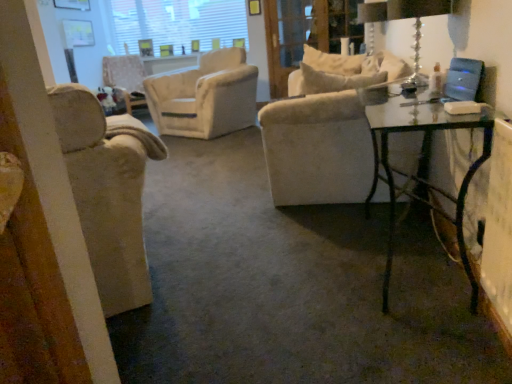
What do you see at coordinates (419, 174) in the screenshot? This screenshot has height=384, width=512. I see `transparent glass table at right` at bounding box center [419, 174].

Based on the photo, measure the distance between point (110, 29) and camera.

24.45 feet.

Identify the location of beige fabric chair at left, which appears as the first chair when ordered from the bottom. (108, 191).

Measure the distance between point (300,44) and camera.

They are 15.71 feet apart.

Locate an element on the screen. The image size is (512, 384). velvet beige armchair at center, positioned as the 2th chair in front-to-back order is located at coordinates (125, 79).

Find the location of a particular element. screen door in front of the velvet beige armchair at center, marked as the first chair in a top-to-bottom arrangement is located at coordinates (292, 37).

From the image's perspective, which one is positioned higher, velvet beige armchair at center, marked as the first chair in a top-to-bottom arrangement, or clear glass screen door at upper center?

From the image's view, clear glass screen door at upper center is above.

In the scene shown: Does velvet beige armchair at center, marked as the first chair in a top-to-bottom arrangement, have a greater height compared to clear glass screen door at upper center?

No, velvet beige armchair at center, marked as the first chair in a top-to-bottom arrangement, is not taller than clear glass screen door at upper center.

Is point (125, 201) more distant than point (283, 20)?

No, (125, 201) is closer to viewer.

Are beige fabric chair at left, which appears as the second chair when viewed from the top, and clear glass screen door at upper center far apart?

Yes, beige fabric chair at left, which appears as the second chair when viewed from the top, is far from clear glass screen door at upper center.

How different are the orientations of beige fabric chair at left, which is the 1th chair from right to left, and clear glass screen door at upper center in degrees?

beige fabric chair at left, which is the 1th chair from right to left, and clear glass screen door at upper center are facing 142 degrees away from each other.

Considering the relative positions of beige fabric chair at left, marked as the 2th chair in a left-to-right arrangement, and clear glass screen door at upper center in the image provided, is beige fabric chair at left, marked as the 2th chair in a left-to-right arrangement, to the left or to the right of clear glass screen door at upper center?

beige fabric chair at left, marked as the 2th chair in a left-to-right arrangement, is positioned on clear glass screen door at upper center's left side.

Is clear glass table lamp at upper right positioned in front of white textured window screen at upper center?

Yes, the depth of clear glass table lamp at upper right is less than that of white textured window screen at upper center.

Where is `table lamp that is below the white textured window screen at upper center (from the image's perspective)`? table lamp that is below the white textured window screen at upper center (from the image's perspective) is located at coordinates (417, 24).

Is clear glass table lamp at upper right oriented away from white textured window screen at upper center?

clear glass table lamp at upper right is not turned away from white textured window screen at upper center.

Measure the distance between clear glass table lamp at upper right and white textured window screen at upper center.

They are 6.21 meters apart.

Which is nearer, (226, 36) or (454, 118)?

Point (226, 36) is positioned farther from the camera compared to point (454, 118).

How different are the orientations of white textured window screen at upper center and transparent glass table at right in degrees?

The facing directions of white textured window screen at upper center and transparent glass table at right are 90.1 degrees apart.

Considering the relative sizes of white textured window screen at upper center and transparent glass table at right in the image provided, is white textured window screen at upper center shorter than transparent glass table at right?

Incorrect, the height of white textured window screen at upper center does not fall short of that of transparent glass table at right.

From a real-world perspective, between velvet beige armchair at center, positioned as the 2th chair in front-to-back order, and clear glass table lamp at upper right, who is vertically higher?

In real-world perspective, clear glass table lamp at upper right is above.

Does velvet beige armchair at center, which ranks as the 2th chair in bottom-to-top order, appear on the right side of clear glass table lamp at upper right?

In fact, velvet beige armchair at center, which ranks as the 2th chair in bottom-to-top order, is to the left of clear glass table lamp at upper right.

Is velvet beige armchair at center, positioned as the 2th chair in front-to-back order, located outside clear glass table lamp at upper right?

Yes, velvet beige armchair at center, positioned as the 2th chair in front-to-back order, is outside of clear glass table lamp at upper right.

Is point (143, 103) positioned after point (413, 47)?

Yes.

I want to click on chair in front of the velvet beige armchair at center, which ranks as the first chair in back-to-front order, so click(108, 191).

Is beige fabric chair at left, which is the 1th chair from right to left, next to velvet beige armchair at center, which ranks as the first chair in left-to-right order, and touching it?

beige fabric chair at left, which is the 1th chair from right to left, and velvet beige armchair at center, which ranks as the first chair in left-to-right order, are not in contact.

Which is nearer, (x=134, y=266) or (x=117, y=89)?

Point (x=134, y=266) is positioned closer to the camera compared to point (x=117, y=89).

From the image's perspective, which object appears higher, beige fabric chair at left, marked as the first chair in a front-to-back arrangement, or velvet beige armchair at center, which ranks as the first chair in back-to-front order?

velvet beige armchair at center, which ranks as the first chair in back-to-front order, is shown above in the image.

Considering the positions of objects beige fabric chair at left, marked as the first chair in a front-to-back arrangement, and white textured window screen at upper center in the image provided, who is more to the left, beige fabric chair at left, marked as the first chair in a front-to-back arrangement, or white textured window screen at upper center?

From the viewer's perspective, white textured window screen at upper center appears more on the left side.

Which is in front, beige fabric chair at left, which appears as the 2th chair when viewed from the back, or white textured window screen at upper center?

beige fabric chair at left, which appears as the 2th chair when viewed from the back, is closer to the camera.

Is beige fabric chair at left, which appears as the second chair when viewed from the top, turned away from white textured window screen at upper center?

That's not correct — beige fabric chair at left, which appears as the second chair when viewed from the top, is not looking away from white textured window screen at upper center.

Between beige fabric chair at left, marked as the 2th chair in a left-to-right arrangement, and white textured window screen at upper center, which one has more height?

With more height is white textured window screen at upper center.

You are a GUI agent. You are given a task and a screenshot of the screen. Output one action in this format:
    pyautogui.click(x=<x>, y=<y>)
    Task: Click on the screen door above the velvet beige armchair at center, which is the 2th chair in right-to-left order (from the image's perspective)
    This screenshot has height=384, width=512.
    Given the screenshot: What is the action you would take?
    pyautogui.click(x=292, y=37)

I want to click on screen door behind the beige fabric chair at left, which appears as the first chair when ordered from the bottom, so click(292, 37).

Estimate the real-world distances between objects in this image. Which object is closer to transparent glass table at right, clear glass screen door at upper center or beige fabric chair at left, which is the 1th chair from right to left?

beige fabric chair at left, which is the 1th chair from right to left, is positioned closer to the anchor transparent glass table at right.

Which object lies nearer to the anchor point white textured window screen at upper center, velvet beige armchair at center, which ranks as the first chair in left-to-right order, or clear glass screen door at upper center?

Based on the image, velvet beige armchair at center, which ranks as the first chair in left-to-right order, appears to be nearer to white textured window screen at upper center.

From the picture: When comparing their distances from transparent glass table at right, does clear glass table lamp at upper right or clear glass screen door at upper center seem further?

Among the two, clear glass screen door at upper center is located further to transparent glass table at right.

Based on their spatial positions, is clear glass table lamp at upper right or white textured window screen at upper center further from velvet beige armchair at center, which ranks as the first chair in back-to-front order?

clear glass table lamp at upper right is further to velvet beige armchair at center, which ranks as the first chair in back-to-front order.

Which object lies further to the anchor point white textured window screen at upper center, clear glass screen door at upper center or velvet beige armchair at center, which ranks as the first chair in back-to-front order?

clear glass screen door at upper center.

Looking at the image, which one is located further to transparent glass table at right, velvet beige armchair at center, which ranks as the first chair in left-to-right order, or white textured window screen at upper center?

white textured window screen at upper center.

Based on their spatial positions, is velvet beige armchair at center, which ranks as the first chair in back-to-front order, or clear glass screen door at upper center closer to clear glass table lamp at upper right?

clear glass screen door at upper center lies closer to clear glass table lamp at upper right than the other object.

When comparing their distances from white textured window screen at upper center, does clear glass screen door at upper center or clear glass table lamp at upper right seem closer?

The object closer to white textured window screen at upper center is clear glass screen door at upper center.

Where is `chair positioned between beige fabric chair at left, which is the 1th chair from right to left, and white textured window screen at upper center from near to far`? chair positioned between beige fabric chair at left, which is the 1th chair from right to left, and white textured window screen at upper center from near to far is located at coordinates (125, 79).

Where is `screen door between transparent glass table at right and white textured window screen at upper center in the front-back direction`? screen door between transparent glass table at right and white textured window screen at upper center in the front-back direction is located at coordinates (292, 37).

At what (x,y) coordinates should I click in order to perform the action: click on screen door positioned between beige fabric chair at left, which appears as the 2th chair when viewed from the back, and white textured window screen at upper center from near to far. Please return your answer as a coordinate pair (x, y). The image size is (512, 384). Looking at the image, I should click on (292, 37).

At what (x,y) coordinates should I click in order to perform the action: click on screen door between beige fabric chair at left, which is the 1th chair from right to left, and velvet beige armchair at center, marked as the first chair in a top-to-bottom arrangement, in the front-back direction. Please return your answer as a coordinate pair (x, y). Looking at the image, I should click on (292, 37).